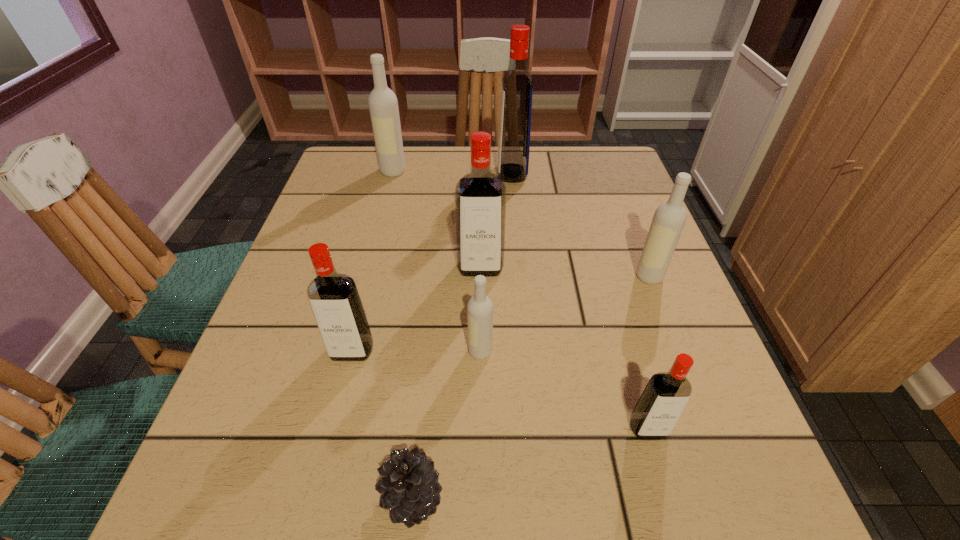
Locate an element on the screen. object that ranks as the closest to the third object from left to right is located at coordinates 334,299.

Identify the location of object that is the fourth closest one to the farthest white vodka. (480, 307).

Locate which vodka is the fifth closest to the rightmost white vodka. Please provide its 2D coordinates. Your answer should be formatted as a tuple, i.e. [(x, y)], where the tuple contains the x and y coordinates of a point satisfying the conditions above.

[(334, 299)]

Identify the location of vodka that is the fifth closest to the brown pinecone. The width and height of the screenshot is (960, 540). (669, 219).

Point out which red vodka is positioned as the third nearest to the rightmost object. Please provide its 2D coordinates. Your answer should be formatted as a tuple, i.e. [(x, y)], where the tuple contains the x and y coordinates of a point satisfying the conditions above.

[(517, 86)]

Identify the location of red vodka object that ranks as the second closest to the leftmost white vodka. The width and height of the screenshot is (960, 540). (480, 196).

You are a GUI agent. You are given a task and a screenshot of the screen. Output one action in this format:
    pyautogui.click(x=<x>, y=<y>)
    Task: Click on the white vodka that is the second closest to the smallest white vodka
    
    Given the screenshot: What is the action you would take?
    pyautogui.click(x=383, y=105)

Where is `white vodka identified as the second closest to the third farthest red vodka`? Image resolution: width=960 pixels, height=540 pixels. white vodka identified as the second closest to the third farthest red vodka is located at coordinates (669, 219).

Where is `vacant space that satisfies the following two spatial constraints: 1. on the front and back of the tallest object; 2. on the back side of the second smallest white vodka`? The width and height of the screenshot is (960, 540). vacant space that satisfies the following two spatial constraints: 1. on the front and back of the tallest object; 2. on the back side of the second smallest white vodka is located at coordinates (522, 276).

The width and height of the screenshot is (960, 540). I want to click on vacant space that satisfies the following two spatial constraints: 1. on the front and back of the biggest red vodka; 2. on the right side of the second biggest white vodka, so click(522, 276).